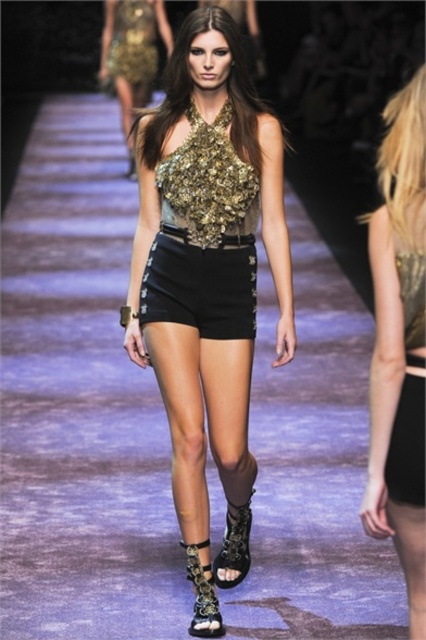
Can you confirm if gold sequined dress at upper center is positioned to the left of leather/golden-patterned boot at lower center?

Indeed, gold sequined dress at upper center is positioned on the left side of leather/golden-patterned boot at lower center.

Who is lower down, gold sequined dress at upper center or leather/golden-patterned boot at lower center?

leather/golden-patterned boot at lower center is below.

This screenshot has width=426, height=640. I want to click on gold sequined dress at upper center, so click(132, 42).

This screenshot has width=426, height=640. What do you see at coordinates (409, 388) in the screenshot?
I see `black matte shorts at lower right` at bounding box center [409, 388].

Does point (411, 388) come behind point (115, 61)?

No.

Which is behind, point (417, 436) or point (123, 12)?

Positioned behind is point (123, 12).

This screenshot has width=426, height=640. I want to click on black matte shorts at lower right, so click(409, 388).

Who is positioned more to the left, leather lace boot at lower center or leather/golden-patterned boot at lower center?

Positioned to the left is leather/golden-patterned boot at lower center.

Is the position of leather lace boot at lower center more distant than that of leather/golden-patterned boot at lower center?

Yes, it is behind leather/golden-patterned boot at lower center.

Locate an element on the screen. The image size is (426, 640). leather lace boot at lower center is located at coordinates (235, 545).